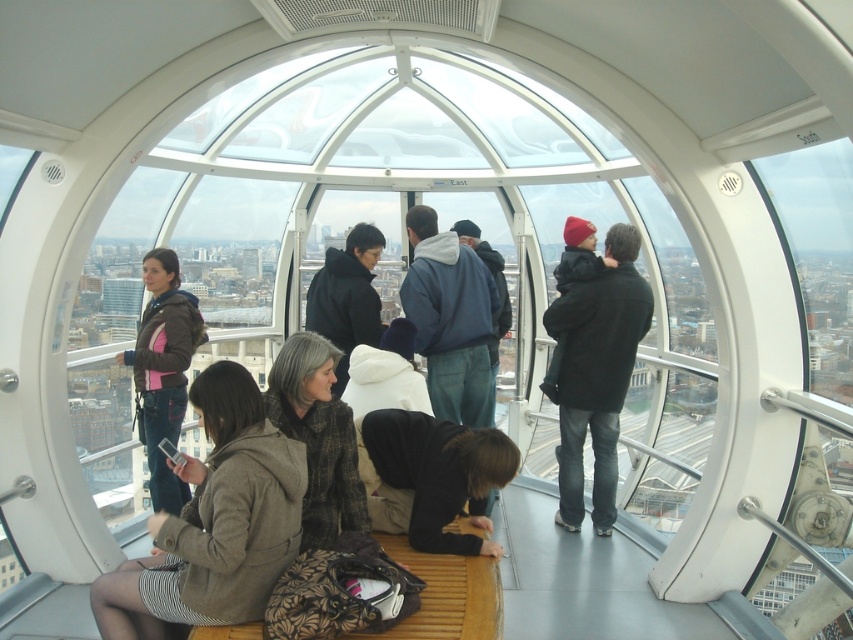
Question: Is dark brown leather jacket at lower center in front of brown textured coat at center?

Choices:
 (A) yes
 (B) no

Answer: (B)

Question: Which of the following is the farthest from the observer?

Choices:
 (A) (631, 257)
 (B) (131, 566)

Answer: (A)

Question: Which object is farther from the camera taking this photo?

Choices:
 (A) dark brown leather jacket at lower center
 (B) blue fleece jacket at center

Answer: (B)

Question: Which of these objects is positioned farthest from the brown textured coat at center?

Choices:
 (A) matte black coat at center
 (B) blue fleece jacket at center
 (C) brown textured coat at lower left
 (D) matte black jacket at left

Answer: (A)

Question: Does matte black coat at center have a lesser width compared to brown textured coat at center?

Choices:
 (A) no
 (B) yes

Answer: (A)

Question: Considering the relative positions of brown textured coat at lower left and blue fleece jacket at center in the image provided, where is brown textured coat at lower left located with respect to blue fleece jacket at center?

Choices:
 (A) right
 (B) left

Answer: (B)